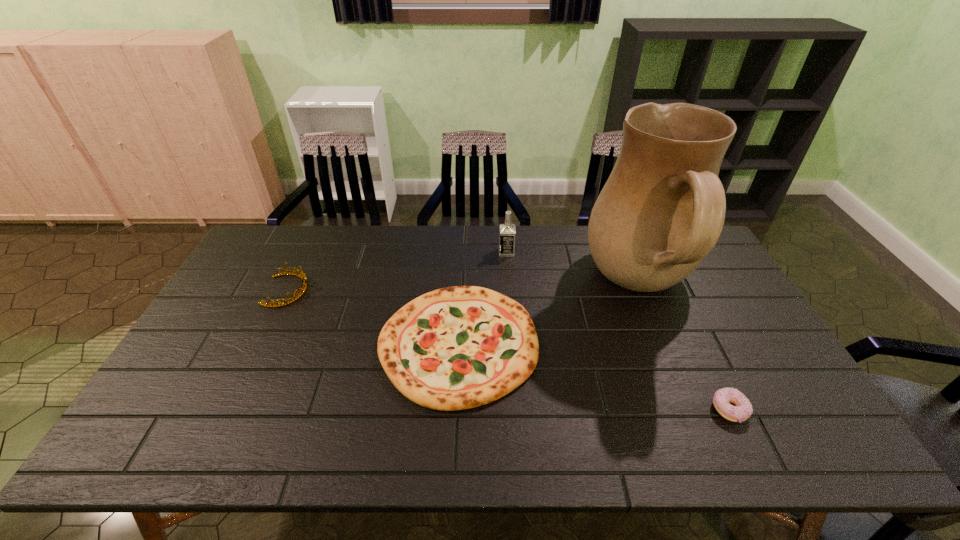
In order to click on the tallest object in this screenshot , I will do `click(662, 210)`.

Find the location of a particular element. the fourth shortest object is located at coordinates (507, 231).

Identify the location of tiara. This screenshot has width=960, height=540. (303, 288).

Identify the location of the leftmost object. (303, 288).

Where is `pizza`? The height and width of the screenshot is (540, 960). pizza is located at coordinates (455, 348).

I want to click on doughnut, so click(x=742, y=409).

Locate an element on the screen. free region located 0.070m at the spout of the cream pitcher is located at coordinates (563, 287).

At what (x,y) coordinates should I click in order to perform the action: click on vacant region located at the spout of the cream pitcher. Please return your answer as a coordinate pair (x, y). Image resolution: width=960 pixels, height=540 pixels. Looking at the image, I should click on (506, 287).

You are a GUI agent. You are given a task and a screenshot of the screen. Output one action in this format:
    pyautogui.click(x=<x>, y=<y>)
    Task: Click on the free space located 0.160m at the spout of the cream pitcher
    This screenshot has height=540, width=960.
    Given the screenshot: What is the action you would take?
    pyautogui.click(x=535, y=287)

Where is `vacant space located on the front label of the fourth shortest object`? This screenshot has height=540, width=960. vacant space located on the front label of the fourth shortest object is located at coordinates (407, 252).